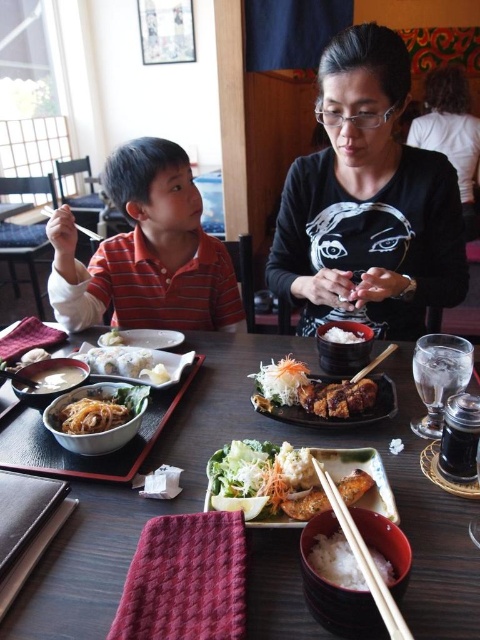
You are a guest at this Japanese restaurant and you see two pairs of wooden chopsticks at center and wooden chopsticks at upper left on the table. Which pair is positioned lower on the table?

The wooden chopsticks at center is positioned lower than the wooden chopsticks at upper left, so the wooden chopsticks at center is the lower one.

You are a server at the restaurant and need to place a new dish on the table. Considering the wooden table at center and the black matte shirt at center, which object allows more space for placing the dish?

The wooden table at center is bigger than the black matte shirt at center, so the wooden table at center allows more space for placing the dish.

You are a waiter at the restaurant and need to place a small bowl of soy sauce exactly where the chopsticks are. Is the point marked at coordinates (373, 364) the correct location for placing the soy sauce bowl?

Yes, the point marked at coordinates (373, 364) is the correct location because it marks the wooden chopsticks at center, so placing the soy sauce bowl there would be appropriate.